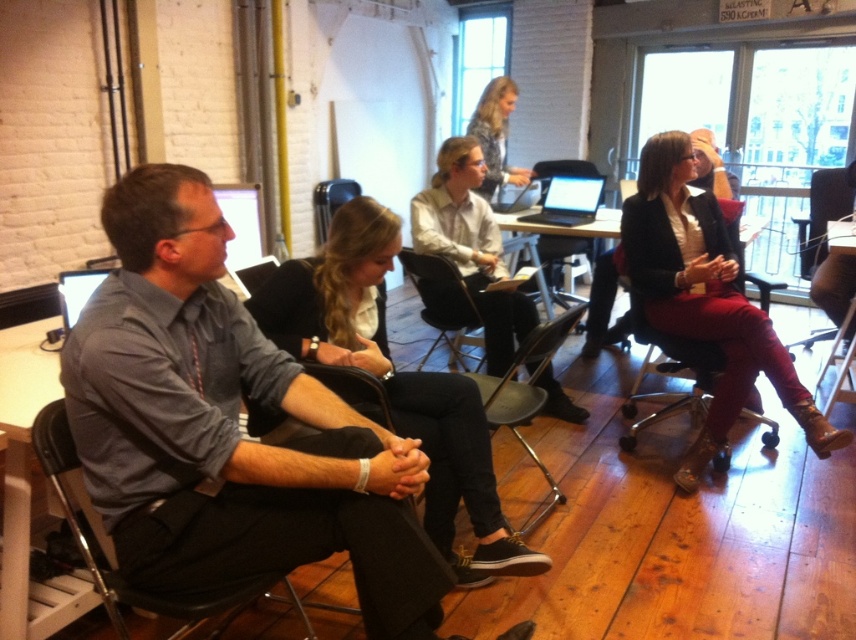
Question: Which point is farther from the camera taking this photo?

Choices:
 (A) click(468, 388)
 (B) click(554, 179)
 (C) click(538, 346)
 (D) click(152, 404)

Answer: (B)

Question: Which object is closer to the camera taking this photo?

Choices:
 (A) metallic silver chair at center
 (B) silver metallic laptop at center
 (C) metallic silver chair at lower right

Answer: (C)

Question: Which object appears farthest from the camera in this image?

Choices:
 (A) black plastic chair at left
 (B) white shirt at center

Answer: (B)

Question: Is black plastic chair at left further to camera compared to metallic black chair at center-right?

Choices:
 (A) no
 (B) yes

Answer: (A)

Question: Is black plastic chair at left positioned in front of metallic silver chair at lower right?

Choices:
 (A) yes
 (B) no

Answer: (A)

Question: From the image, what is the correct spatial relationship of metallic black chair at center-right in relation to metallic gray chair at center?

Choices:
 (A) left
 (B) right

Answer: (B)